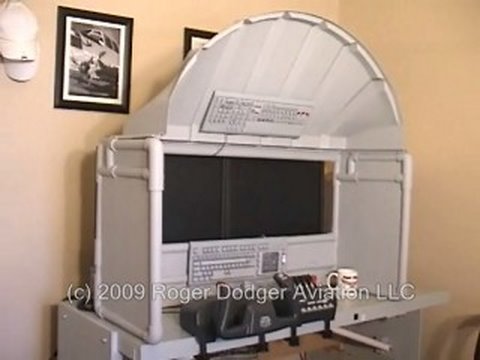
Where is `metal desk with side walls and a curved roof`? Image resolution: width=480 pixels, height=360 pixels. metal desk with side walls and a curved roof is located at coordinates (136, 188), (124, 332), (418, 306), (390, 209), (284, 66).